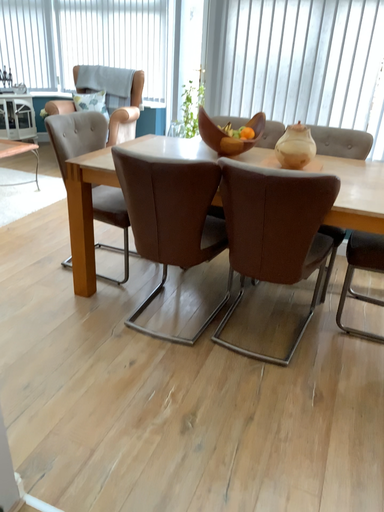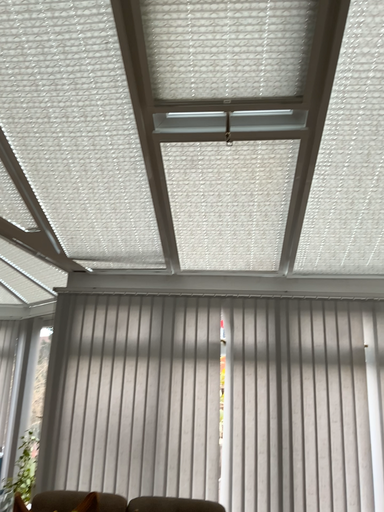
Question: Which way did the camera rotate in the video?

Choices:
 (A) rotated downward
 (B) rotated upward

Answer: (B)